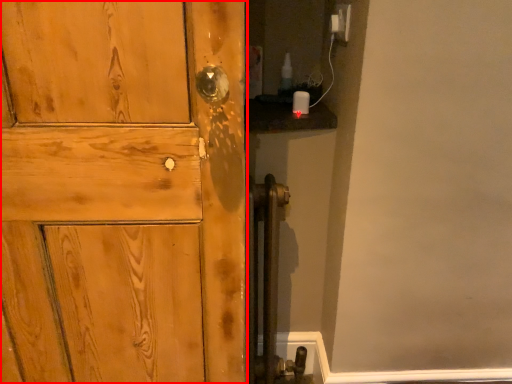
Question: From the image's perspective, where is door (annotated by the red box) located in relation to electric outlet in the image?

Choices:
 (A) below
 (B) above

Answer: (A)